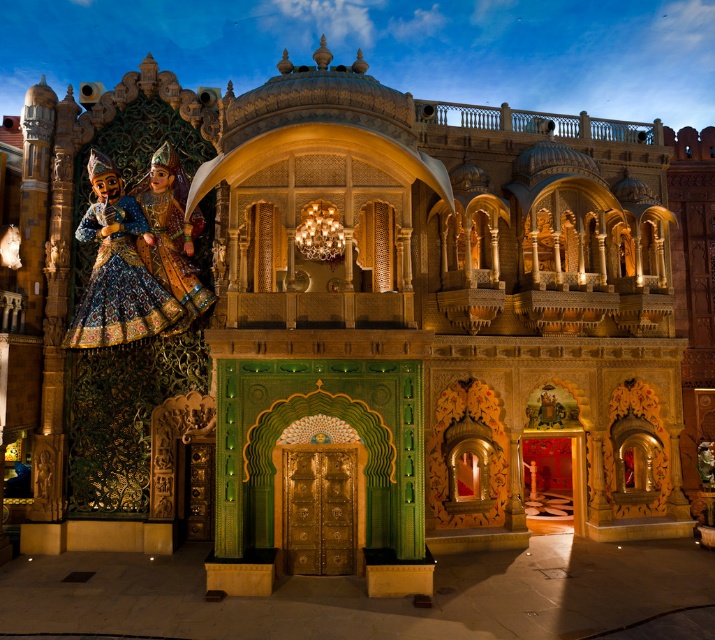
You are attending a cultural event at the temple and notice two items on the left side of the entrance. The blue embroidered fabric at left and the shiny gold dress at left. Which one is shorter?

The blue embroidered fabric at left is not as tall as the shiny gold dress at left, so the blue embroidered fabric at left is shorter.

You are standing at the entrance of the temple and want to take a photo of the blue embroidered fabric at left. Your camera is 25.50 meters away from the fabric. Is the camera within a 25 meter range for optimal focus? Please explain.

The blue embroidered fabric at left and the camera are 25.50 meters apart. Since 25.50 meters exceeds the 25 meter optimal focus range, the camera is slightly out of range for optimal focus.

You are an interior designer examining the intricate structure. You notice the blue embroidered fabric at left and the shiny gold dress at left. Which object is located closer to the bottom of the image?

The blue embroidered fabric at left is positioned under the shiny gold dress at left, so it is closer to the bottom of the image.